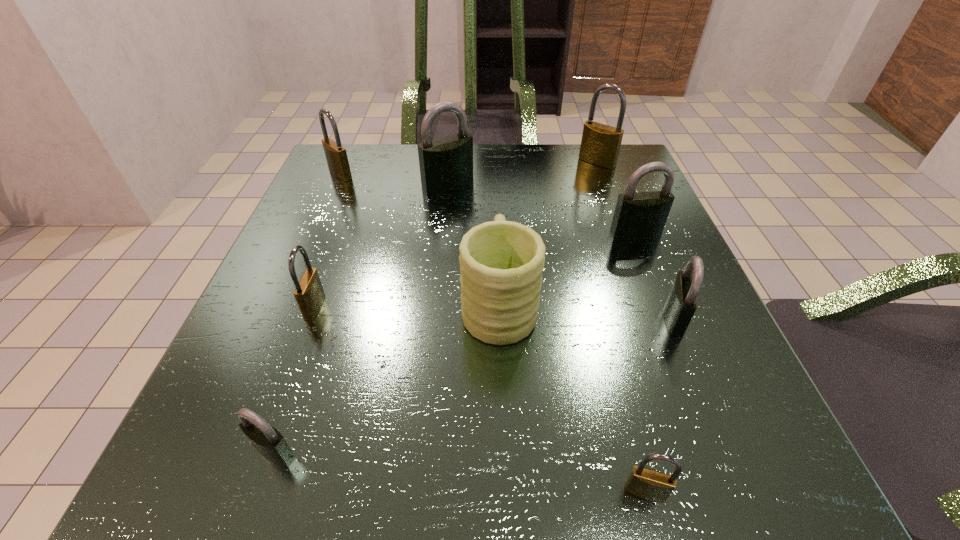
Find the location of a particular element. This screenshot has width=960, height=540. free point between the rightmost brass padlock and the second nearest black padlock is located at coordinates (636, 240).

Where is `free space between the second nearest padlock and the second brass padlock from right to left`? The image size is (960, 540). free space between the second nearest padlock and the second brass padlock from right to left is located at coordinates (460, 472).

Locate an element on the screen. The height and width of the screenshot is (540, 960). free spot between the fourth farthest padlock and the leftmost brass padlock is located at coordinates (488, 204).

This screenshot has height=540, width=960. Identify the location of vacant area that lies between the third brass padlock from right to left and the third black padlock from right to left. (381, 245).

You are a GUI agent. You are given a task and a screenshot of the screen. Output one action in this format:
    pyautogui.click(x=<x>, y=<y>)
    Task: Click on the object that ranks as the closest to the leftmost black padlock
    The width and height of the screenshot is (960, 540).
    Given the screenshot: What is the action you would take?
    pyautogui.click(x=309, y=294)

Find the location of `object that is the fifth closest to the second biggest black padlock`. object that is the fifth closest to the second biggest black padlock is located at coordinates (648, 484).

Identify the location of padlock that is the seventh closest to the third farthest black padlock. click(336, 156).

You are a GUI agent. You are given a task and a screenshot of the screen. Output one action in this format:
    pyautogui.click(x=<x>, y=<y>)
    Task: Click on the fifth closest padlock to the third farthest black padlock
    This screenshot has width=960, height=540.
    Given the screenshot: What is the action you would take?
    pyautogui.click(x=268, y=441)

Image resolution: width=960 pixels, height=540 pixels. I want to click on brass padlock that is the closest to the leftmost padlock, so click(309, 294).

At what (x,y) coordinates should I click in order to perform the action: click on brass padlock that is the second closest to the biggest brass padlock. Please return your answer as a coordinate pair (x, y). Looking at the image, I should click on (309, 294).